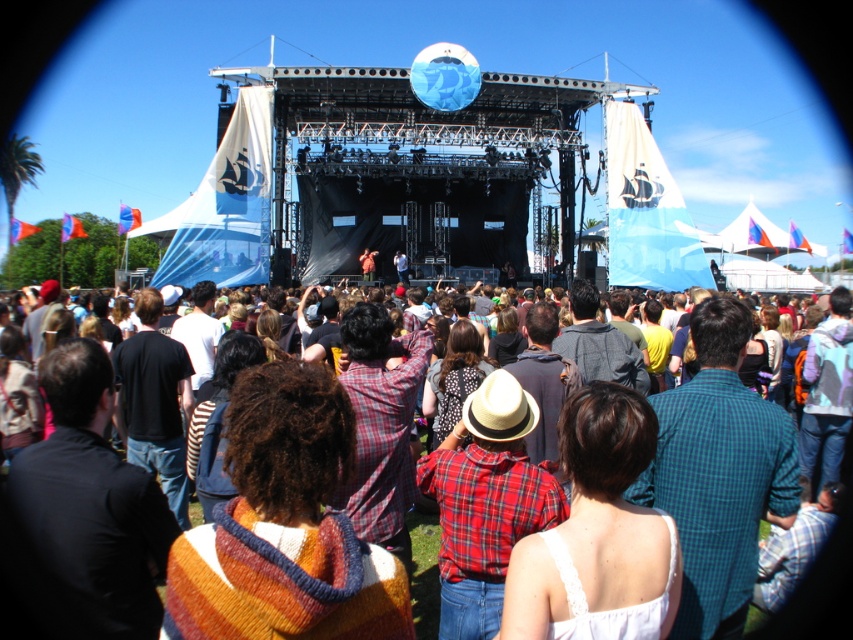
You are a photographer at the concert trying to capture a candid shot of the crowd. You notice the plaid shirt at center and the white felt cowboy hat at center. Which object would appear wider in your photo?

The plaid shirt at center would appear wider in the photo since its width surpasses that of the white felt cowboy hat at center.

You are a photographer at the concert and want to capture a clear photo of the plaid shirt at center and the white felt cowboy hat at center. Given that your camera can only focus on the larger object, which object will be in focus?

The plaid shirt at center is larger in size than the white felt cowboy hat at center, so the camera will focus on the plaid shirt at center.